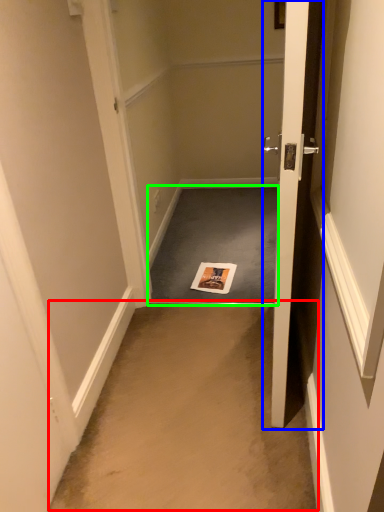
Question: Which object is positioned farthest from corridor (highlighted by a red box)? Select from door (highlighted by a blue box) and doormat (highlighted by a green box).

Choices:
 (A) door
 (B) doormat

Answer: (B)